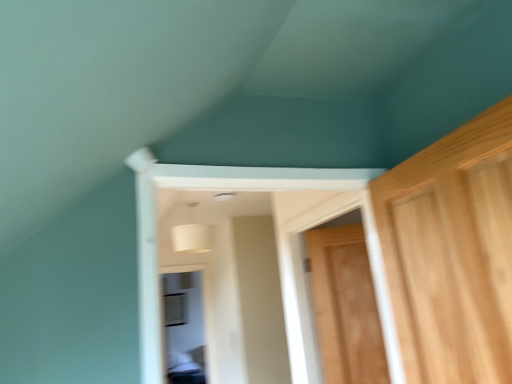
This screenshot has height=384, width=512. Identify the location of transparent glass window at center. coord(184,327).

This screenshot has width=512, height=384. What do you see at coordinates (184, 327) in the screenshot? I see `transparent glass window at center` at bounding box center [184, 327].

The width and height of the screenshot is (512, 384). Describe the element at coordinates (346, 306) in the screenshot. I see `wooden door at right` at that location.

I want to click on wooden door at right, so click(x=346, y=306).

You are a GUI agent. You are given a task and a screenshot of the screen. Output one action in this format:
    pyautogui.click(x=<x>, y=<y>)
    Task: Click on the transparent glass window at center
    The image size is (512, 384).
    Given the screenshot: What is the action you would take?
    pyautogui.click(x=184, y=327)

In the image, is transparent glass window at center on the left side or the right side of wooden door at right?

From the image, it's evident that transparent glass window at center is to the left of wooden door at right.

Who is more distant, transparent glass window at center or wooden door at right?

transparent glass window at center is further away from the camera.

Does point (188, 290) appear closer or farther from the camera than point (327, 252)?

Point (188, 290) is positioned farther from the camera compared to point (327, 252).

From the image's perspective, is transparent glass window at center beneath wooden door at right?

Indeed, from the image's perspective, transparent glass window at center is shown beneath wooden door at right.

From a real-world perspective, between transparent glass window at center and wooden door at right, who is vertically lower?

transparent glass window at center is physically lower.

Which of these two, transparent glass window at center or wooden door at right, is wider?

With larger width is transparent glass window at center.

Considering the sizes of objects transparent glass window at center and wooden door at right in the image provided, who is taller, transparent glass window at center or wooden door at right?

transparent glass window at center.

Considering the relative sizes of transparent glass window at center and wooden door at right in the image provided, is transparent glass window at center smaller than wooden door at right?

Actually, transparent glass window at center might be larger than wooden door at right.

Is transparent glass window at center outside of wooden door at right?

Yes.

Is transparent glass window at center touching wooden door at right?

No.

Is wooden door at right at the back of transparent glass window at center?

No, transparent glass window at center's orientation is not away from wooden door at right.

Where is `window behind the wooden door at right`? window behind the wooden door at right is located at coordinates (184, 327).

Is wooden door at right at the left side of transparent glass window at center?

Incorrect, wooden door at right is not on the left side of transparent glass window at center.

Is wooden door at right positioned before transparent glass window at center?

Yes, wooden door at right is closer to the camera.

Between point (323, 278) and point (201, 323), which one is positioned behind?

The point (201, 323) is more distant.

From the image's perspective, is wooden door at right positioned above or below transparent glass window at center?

wooden door at right is situated higher than transparent glass window at center in the image.

From a real-world perspective, which is physically above, wooden door at right or transparent glass window at center?

From a 3D spatial view, wooden door at right is above.

In terms of width, does wooden door at right look wider or thinner when compared to transparent glass window at center?

Considering their sizes, wooden door at right looks slimmer than transparent glass window at center.

Which of these two, wooden door at right or transparent glass window at center, stands taller?

With more height is transparent glass window at center.

Considering the sizes of wooden door at right and transparent glass window at center in the image, is wooden door at right bigger or smaller than transparent glass window at center?

Considering their sizes, wooden door at right takes up less space than transparent glass window at center.

Is transparent glass window at center a part of wooden door at right?

Definitely not — transparent glass window at center is not inside wooden door at right.

Is wooden door at right positioned far away from transparent glass window at center?

wooden door at right is positioned a significant distance from transparent glass window at center.

Consider the image. Is wooden door at right positioned with its back to transparent glass window at center?

No.

In the scene shown: How many degrees apart are the facing directions of wooden door at right and transparent glass window at center?

36.8 degrees separate the facing orientations of wooden door at right and transparent glass window at center.

What are the coordinates of `door lying on the right of transparent glass window at center` in the screenshot? It's located at (346, 306).

Locate an element on the screen. door lying on the right of transparent glass window at center is located at coordinates (346, 306).

What are the coordinates of `window behind the wooden door at right` in the screenshot? It's located at (184, 327).